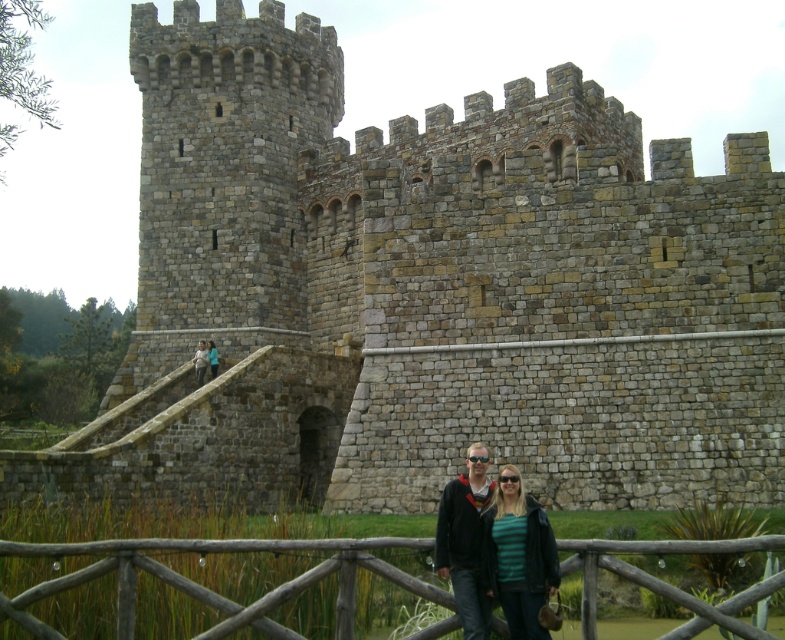
You are a photographer standing at the base of the castle, looking up at the wooden fence at lower center and the matte black jacket at lower center. Which object appears taller in the scene?

The matte black jacket at lower center is taller than the wooden fence at lower center.

You are standing at the base of the medieval castle and want to reach the point marked at coordinate point (480, 612). If your camera can zoom in up to 30 meters, can you clearly see details at that point?

The point at coordinate point (480, 612) is 32.35 meters away, which is beyond the camera zoom limit of 30 meters. Therefore, you cannot clearly see details at that point.

You are a photographer standing at the base of the castle, looking up towards the wooden fence at lower center and the light blue denim jacket at lower center. Which object is taller in the image?

The wooden fence at lower center is much taller than the light blue denim jacket at lower center.